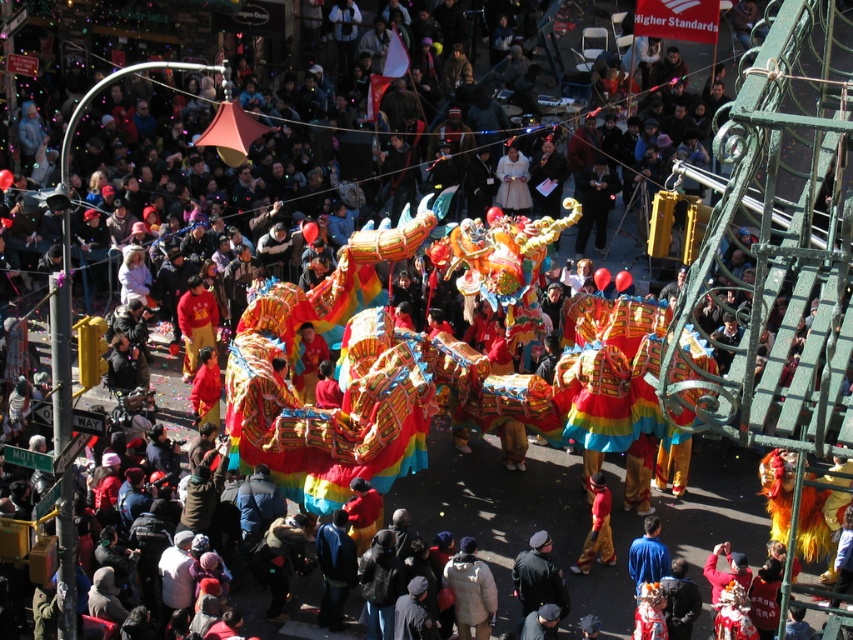
Describe the element at coordinates (538, 577) in the screenshot. I see `dark blue uniform at center` at that location.

Does dark blue uniform at center appear on the right side of red fabric pants at lower center?

No, dark blue uniform at center is not to the right of red fabric pants at lower center.

Who is more forward, (543,593) or (595,492)?

Point (543,593) is more forward.

I want to click on dark blue uniform at center, so click(x=538, y=577).

Can you confirm if white cotton jacket at center is positioned to the right of dark blue uniform at center?

No, white cotton jacket at center is not to the right of dark blue uniform at center.

Can you confirm if white cotton jacket at center is thinner than dark blue uniform at center?

Indeed, white cotton jacket at center has a lesser width compared to dark blue uniform at center.

Is point (474, 557) closer to camera compared to point (520, 557)?

Yes, point (474, 557) is in front of point (520, 557).

This screenshot has height=640, width=853. I want to click on white cotton jacket at center, so click(469, 589).

Based on the photo, is white cotton jacket at center above red fabric pants at lower center?

No, white cotton jacket at center is not above red fabric pants at lower center.

Which of these two, white cotton jacket at center or red fabric pants at lower center, stands taller?

Standing taller between the two is red fabric pants at lower center.

Between point (480, 621) and point (608, 515), which one is positioned in front?

Positioned in front is point (480, 621).

The width and height of the screenshot is (853, 640). What are the coordinates of `white cotton jacket at center` in the screenshot? It's located at (469, 589).